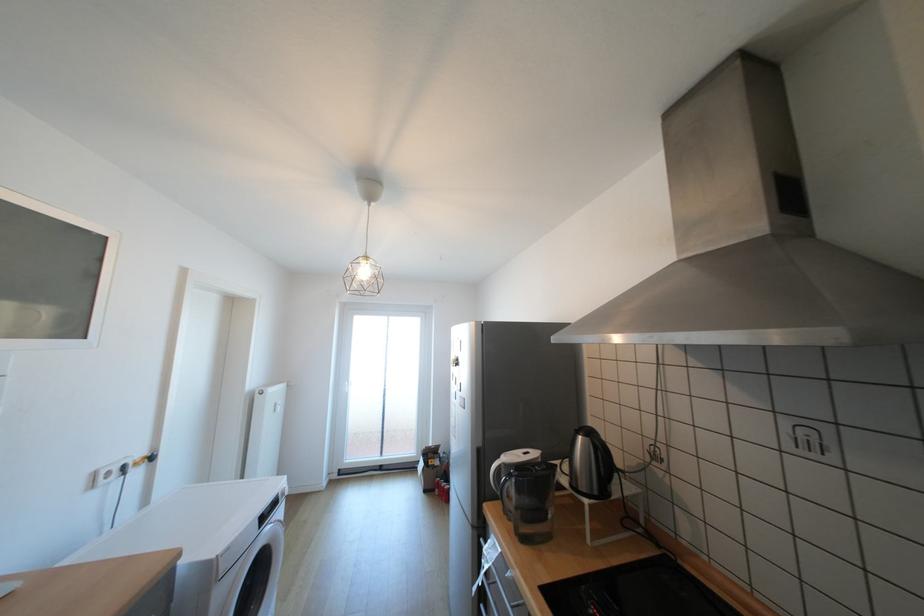
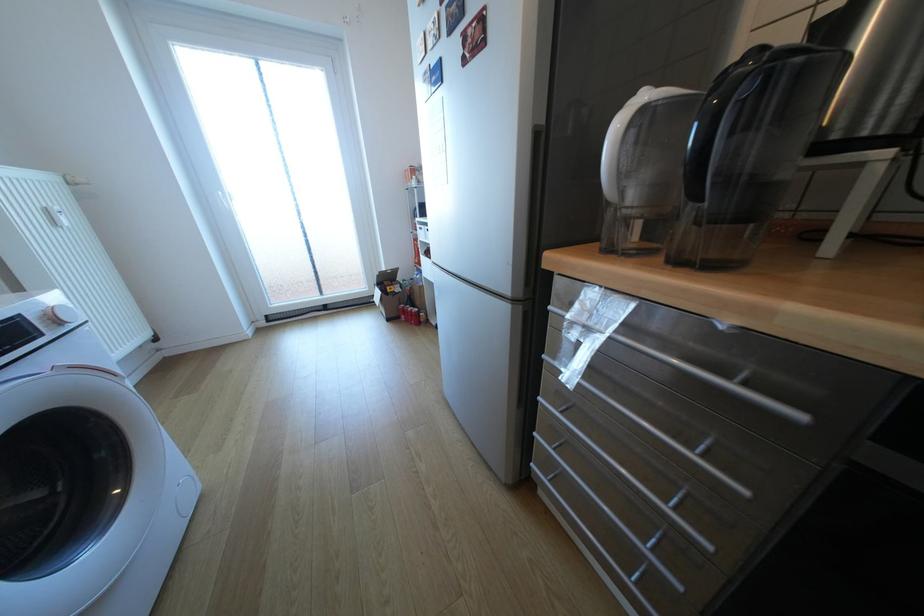
Find the pixel in the second image that matches (x=348, y=469) in the first image.

(275, 315)